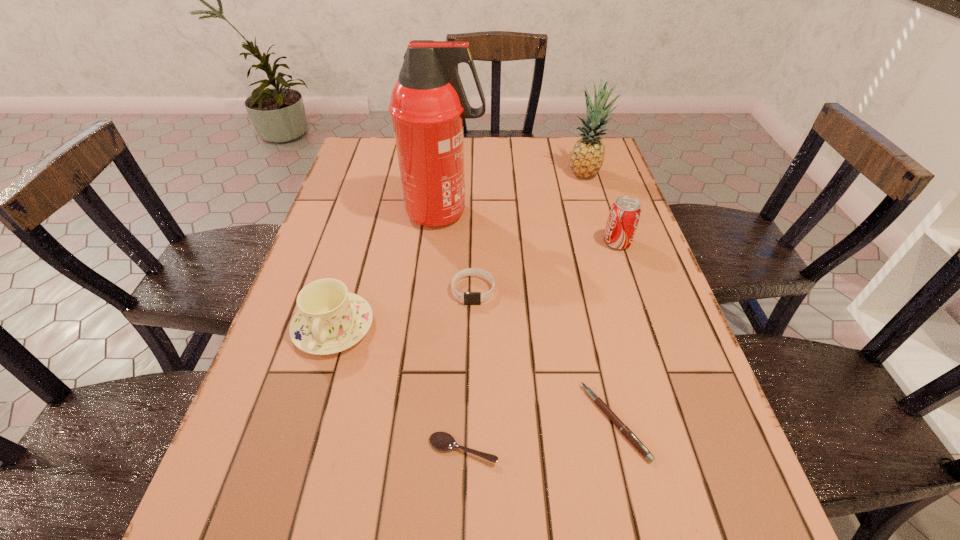
You are a GUI agent. You are given a task and a screenshot of the screen. Output one action in this format:
    pyautogui.click(x=<x>, y=<y>)
    Task: Click on the unoccupied area between the wristband and the fourth tallest object
    
    Given the screenshot: What is the action you would take?
    pyautogui.click(x=403, y=308)

Identify the location of the fourth closest object relative to the sixth tallest object. (330, 319).

At what (x,y) coordinates should I click in order to perform the action: click on object that is the sixth closest to the pineapple. Please return your answer as a coordinate pair (x, y). This screenshot has width=960, height=540. Looking at the image, I should click on (442, 441).

You are a GUI agent. You are given a task and a screenshot of the screen. Output one action in this format:
    pyautogui.click(x=<x>, y=<y>)
    Task: Click on the free location that satisfies the following two spatial constraints: 1. on the trigger side of the soupspoon; 2. on the left side of the tallest object
    
    Given the screenshot: What is the action you would take?
    pyautogui.click(x=422, y=449)

Find the location of a particular element. The height and width of the screenshot is (540, 960). blank area in the image that satisfies the following two spatial constraints: 1. on the handle side of the leftmost object; 2. on the left side of the shortest object is located at coordinates (297, 449).

The width and height of the screenshot is (960, 540). Find the location of `blank area in the image that satisfies the following two spatial constraints: 1. on the trigger side of the tallest object; 2. on the right side of the third farthest object`. blank area in the image that satisfies the following two spatial constraints: 1. on the trigger side of the tallest object; 2. on the right side of the third farthest object is located at coordinates 442,242.

The width and height of the screenshot is (960, 540). What are the coordinates of `vacant space that satisfies the following two spatial constraints: 1. on the back side of the third tallest object; 2. on the trigger side of the fire extinguisher` in the screenshot? It's located at (607, 213).

Image resolution: width=960 pixels, height=540 pixels. In order to click on vacant space that satisfies the following two spatial constraints: 1. on the front side of the farthest object; 2. on the right side of the soda in this screenshot , I will do `click(608, 242)`.